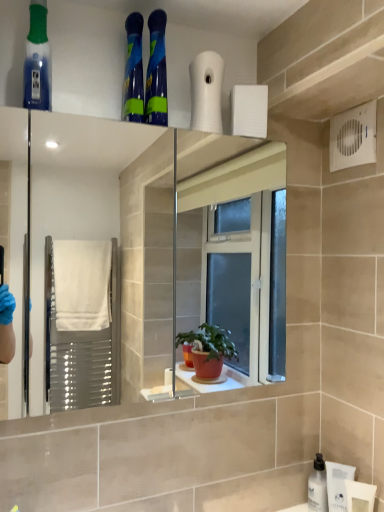
Question: From a real-world perspective, relative to translucent blue mouthwash at upper left, is white plastic bottle at lower right vertically above or below?

Choices:
 (A) above
 (B) below

Answer: (B)

Question: Looking at the image, does white plastic bottle at lower right seem bigger or smaller compared to translucent blue mouthwash at upper left?

Choices:
 (A) big
 (B) small

Answer: (B)

Question: Which of these objects is positioned closest to the white matte bottle at lower right?

Choices:
 (A) white plastic bottle at lower right
 (B) translucent blue mouthwash at upper left

Answer: (A)

Question: Which object is the closest to the white plastic bottle at lower right?

Choices:
 (A) translucent blue mouthwash at upper left
 (B) white matte bottle at lower right

Answer: (B)